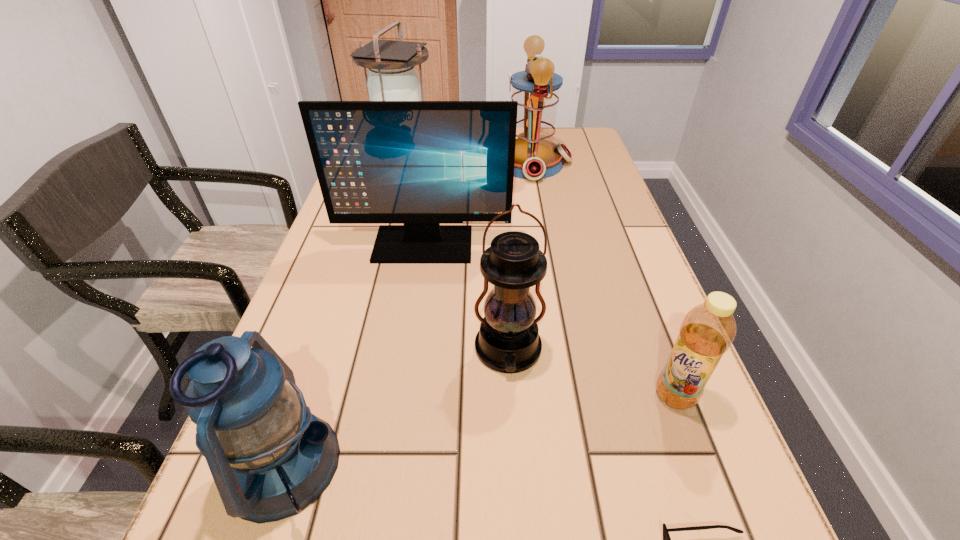
At what (x,y) coordinates should I click in order to perform the action: click on object located in the far left corner section of the desktop. Please return your answer as a coordinate pair (x, y). This screenshot has height=540, width=960. Looking at the image, I should click on (392, 77).

The width and height of the screenshot is (960, 540). In order to click on object present at the far right corner in this screenshot , I will do `click(536, 89)`.

This screenshot has height=540, width=960. In order to click on vacant space at the left edge of the desktop in this screenshot , I will do `click(320, 312)`.

Find the location of a particular element. free region at the right edge of the desktop is located at coordinates (600, 234).

Locate an element on the screen. The image size is (960, 540). free area in between the second shortest object and the monitor is located at coordinates (549, 320).

This screenshot has height=540, width=960. I want to click on blank region between the third farthest object and the bottle, so click(x=549, y=320).

The width and height of the screenshot is (960, 540). What are the coordinates of `free space between the third farthest object and the bottle` in the screenshot? It's located at (549, 320).

This screenshot has width=960, height=540. Find the location of `free point between the bottle and the second nearest lantern`. free point between the bottle and the second nearest lantern is located at coordinates tap(591, 373).

The image size is (960, 540). Find the location of `free space between the monitor and the bottle`. free space between the monitor and the bottle is located at coordinates (549, 320).

Where is `object that can be found as the second closest to the third farthest object`? The width and height of the screenshot is (960, 540). object that can be found as the second closest to the third farthest object is located at coordinates (536, 89).